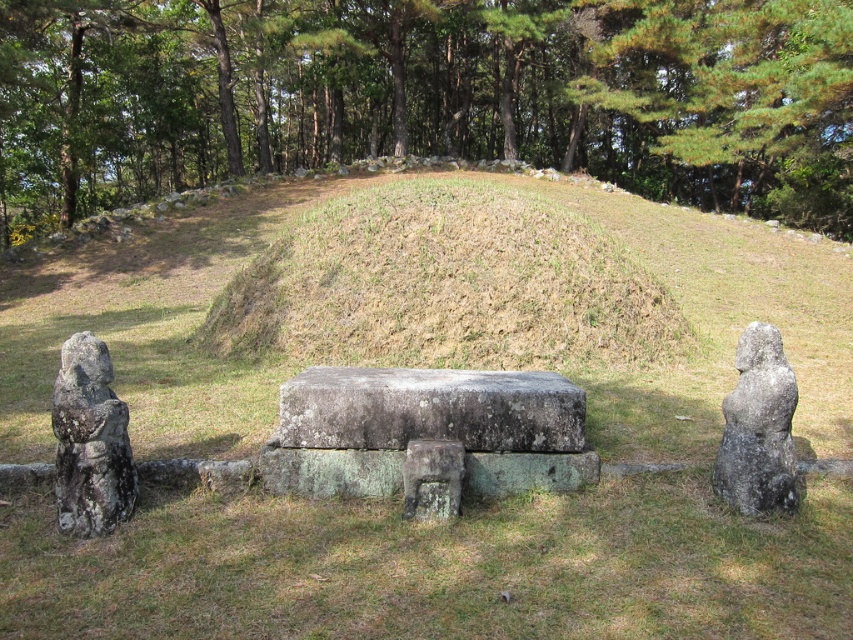
Which of these two, green leafy trees at upper center or rusty stone statue at left, stands shorter?

Standing shorter between the two is rusty stone statue at left.

Between green leafy trees at upper center and rusty stone statue at left, which one is positioned lower?

rusty stone statue at left

Which is in front, point (668, 35) or point (103, 369)?

Point (103, 369)

Where is `green leafy trees at upper center`? green leafy trees at upper center is located at coordinates (428, 96).

Between point (848, 163) and point (792, 458), which one is positioned in front?

Positioned in front is point (792, 458).

Does point (759, 51) come behind point (722, 448)?

Yes, it is behind point (722, 448).

Who is more forward, (677, 10) or (726, 412)?

Point (726, 412)

At what (x,y) coordinates should I click in order to perform the action: click on green leafy tree at upper center. Please return your answer as a coordinate pair (x, y). Looking at the image, I should click on (738, 93).

What do you see at coordinates (445, 285) in the screenshot? The image size is (853, 640). I see `brown grassy mound at center` at bounding box center [445, 285].

Who is positioned more to the right, brown grassy mound at center or green leafy tree at upper center?

green leafy tree at upper center is more to the right.

This screenshot has height=640, width=853. Identify the location of brown grassy mound at center. (445, 285).